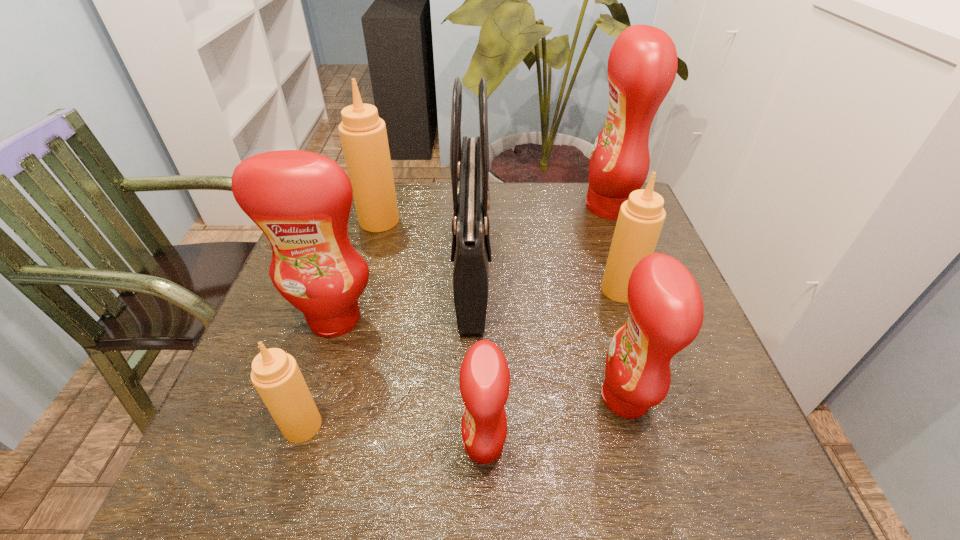
Where is `free spot at the far edge of the desktop`? free spot at the far edge of the desktop is located at coordinates (516, 222).

Locate an element on the screen. This screenshot has height=540, width=960. free space at the near edge is located at coordinates (524, 475).

In the image, there is a desktop. Where is `vacant space at the left edge`? The height and width of the screenshot is (540, 960). vacant space at the left edge is located at coordinates (274, 423).

This screenshot has width=960, height=540. In the image, there is a desktop. Identify the location of vacant region at the right edge. (709, 430).

I want to click on vacant space at the near left corner, so click(x=188, y=484).

Where is `free space between the biggest tan condiment and the biggest red condiment`? The image size is (960, 540). free space between the biggest tan condiment and the biggest red condiment is located at coordinates (494, 214).

Where is `free space between the third biggest red condiment and the smallest red condiment`? The height and width of the screenshot is (540, 960). free space between the third biggest red condiment and the smallest red condiment is located at coordinates (555, 422).

Locate an element on the screen. The width and height of the screenshot is (960, 540). free spot between the leftmost red condiment and the handbag is located at coordinates (404, 294).

Image resolution: width=960 pixels, height=540 pixels. I want to click on vacant point located between the smallest tan condiment and the handbag, so click(x=388, y=347).

Identify the location of vacant area that lies between the biggest tan condiment and the rightmost tan condiment. This screenshot has height=540, width=960. point(500,255).